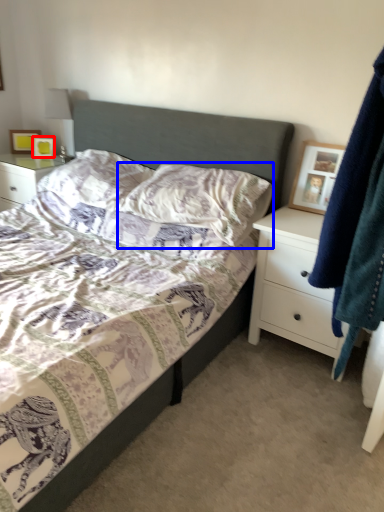
Question: Among these objects, which one is nearest to the camera, picture frame (highlighted by a red box) or pillow (highlighted by a blue box)?

Choices:
 (A) picture frame
 (B) pillow

Answer: (B)